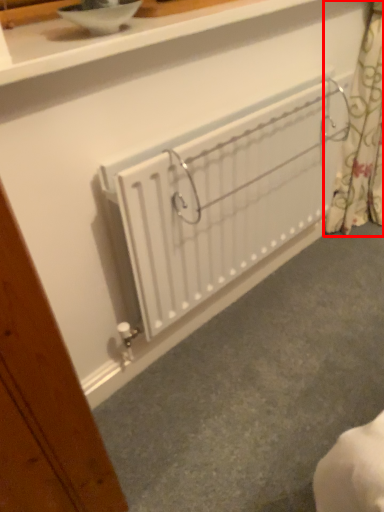
Question: From the image's perspective, considering the relative positions of curtain (annotated by the red box) and radiator in the image provided, where is curtain (annotated by the red box) located with respect to the staircase?

Choices:
 (A) below
 (B) above

Answer: (B)